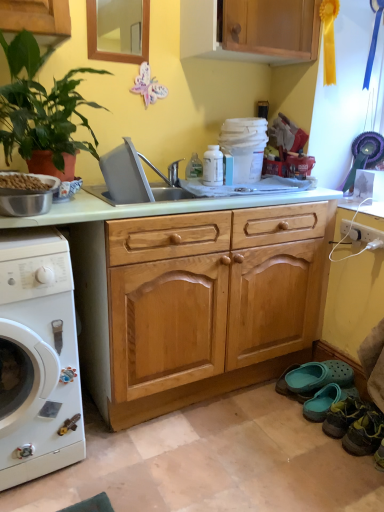
Question: In terms of size, does leather shoe at lower right, which is the second shoe from front to back, appear bigger or smaller than green leafy plant at left?

Choices:
 (A) small
 (B) big

Answer: (A)

Question: Is leather shoe at lower right, which is the second shoe from front to back, wider or thinner than green leafy plant at left?

Choices:
 (A) thin
 (B) wide

Answer: (A)

Question: Which object is the closest to the teal rubber clog at lower right, the 2th shoe when ordered from back to front?

Choices:
 (A) green leafy plant at left
 (B) teal rubber clog at lower right, which is the 4th shoe in front-to-back order
 (C) leather shoe at lower right, the 4th shoe viewed from the back
 (D) white glossy washing machine at left
 (E) brown matte dog food at left

Answer: (B)

Question: Which is nearer to the wooden cabinet at upper center?

Choices:
 (A) teal rubber clog at lower right, the 2th shoe when ordered from back to front
 (B) white glossy washing machine at left
 (C) green leafy plant at left
 (D) leather shoe at lower right, which is the second shoe from front to back
 (E) leather shoe at lower right, placed as the first shoe when sorted from front to back

Answer: (C)